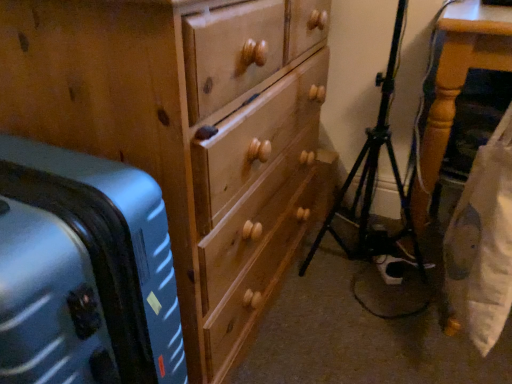
Find the location of a particular element. The image size is (512, 384). free space in front of black metal tripod at lower right is located at coordinates (345, 351).